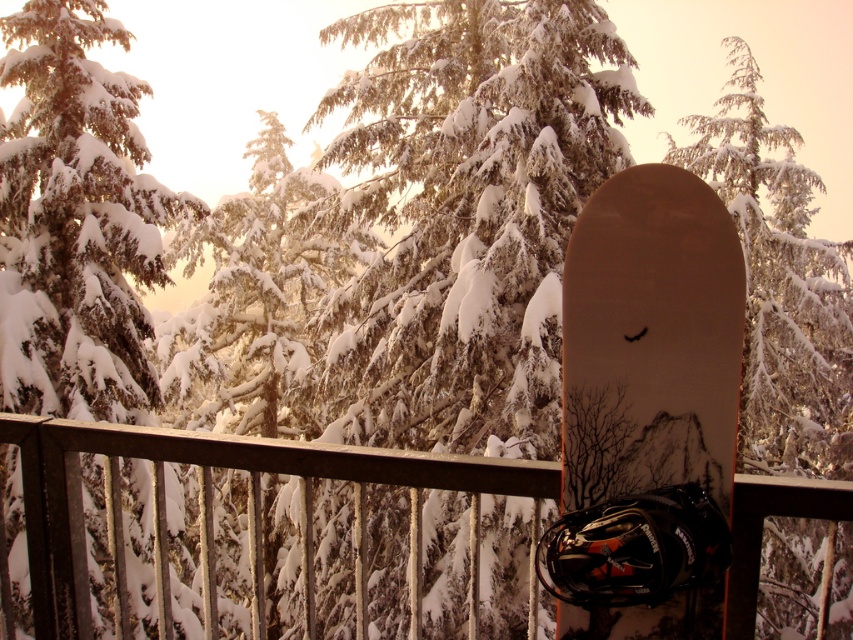
Question: Considering the relative positions of green matte tree at center and snowy pine tree at center in the image provided, where is green matte tree at center located with respect to snowy pine tree at center?

Choices:
 (A) right
 (B) left

Answer: (B)

Question: Estimate the real-world distances between objects in this image. Which object is closer to the matte brown snowboard at center?

Choices:
 (A) metallic brown snowboard at center
 (B) green matte tree at center
 (C) snowy evergreen at center
 (D) snowy evergreen tree at center

Answer: (A)

Question: Does matte brown snowboard at center have a greater width compared to snowy evergreen tree at center?

Choices:
 (A) yes
 (B) no

Answer: (B)

Question: Which of the following is the closest to the observer?

Choices:
 (A) metallic brown snowboard at center
 (B) snowy evergreen at center
 (C) snowy pine tree at center
 (D) snowy evergreen tree at center

Answer: (C)

Question: Which object is the farthest from the snowy evergreen tree at center?

Choices:
 (A) snowy pine tree at center
 (B) matte brown snowboard at center
 (C) snowy evergreen at center
 (D) green matte tree at center

Answer: (B)

Question: Is green matte tree at center smaller than metallic brown snowboard at center?

Choices:
 (A) no
 (B) yes

Answer: (A)